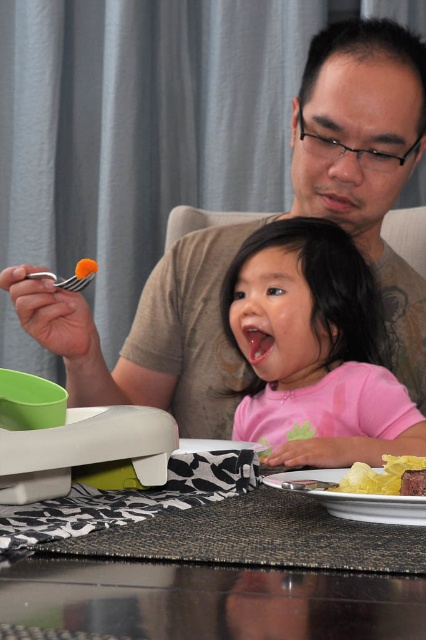
Who is more forward, (305, 81) or (325, 403)?

Point (325, 403) is more forward.

Does matte brown shirt at upper center have a greater height compared to pink matte shirt at center?

Yes.

Where is `matte brown shirt at upper center`? The height and width of the screenshot is (640, 426). matte brown shirt at upper center is located at coordinates (365, 163).

How distant is black textured placemat at lower center from pink matte shirt at center?

The distance of black textured placemat at lower center from pink matte shirt at center is 19.82 inches.

Is black textured placemat at lower center above pink matte shirt at center?

No.

Measure the distance between black textured placemat at lower center and camera.

black textured placemat at lower center is 8.66 inches away from camera.

Where is `black textured placemat at lower center`? The height and width of the screenshot is (640, 426). black textured placemat at lower center is located at coordinates [224, 579].

Who is more forward, (368, 516) or (353, 477)?

Point (368, 516) is in front.

Is white glossy plate at lower center bigger than yellow crispy chips at lower right?

Indeed, white glossy plate at lower center has a larger size compared to yellow crispy chips at lower right.

At what (x,y) coordinates should I click in order to perform the action: click on white glossy plate at lower center. Please return your answer as a coordinate pair (x, y). Looking at the image, I should click on (371, 506).